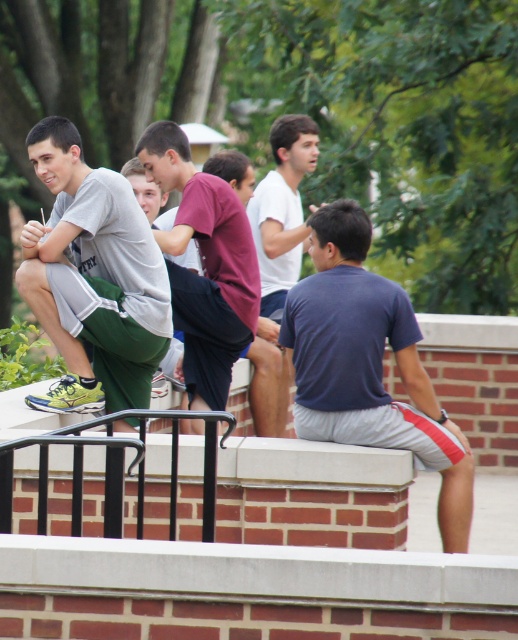
Is dark blue t-shirt at center behind white matte shirt at center?

That is False.

Who is taller, dark blue t-shirt at center or white matte shirt at center?

dark blue t-shirt at center

Does point (294, 360) come farther from viewer compared to point (264, 232)?

No, it is not.

What are the coordinates of `dark blue t-shirt at center` in the screenshot? It's located at (368, 364).

Does matte maroon shirt at center have a larger size compared to black metal rail at lower left?

Yes, matte maroon shirt at center is bigger than black metal rail at lower left.

Which of these two, matte maroon shirt at center or black metal rail at lower left, stands shorter?

Standing shorter between the two is black metal rail at lower left.

Who is more forward, (237, 336) or (76, 436)?

Point (76, 436)

In order to click on matte maroon shirt at center in this screenshot , I will do `click(205, 266)`.

Which of these two, white matte shirt at center or black metal rail at lower left, stands shorter?

Standing shorter between the two is black metal rail at lower left.

Can you confirm if white matte shirt at center is positioned above black metal rail at lower left?

Indeed, white matte shirt at center is positioned over black metal rail at lower left.

Which is in front, point (269, 218) or point (122, 444)?

Point (122, 444) is more forward.

Find the location of `white matte shirt at center`. white matte shirt at center is located at coordinates (278, 260).